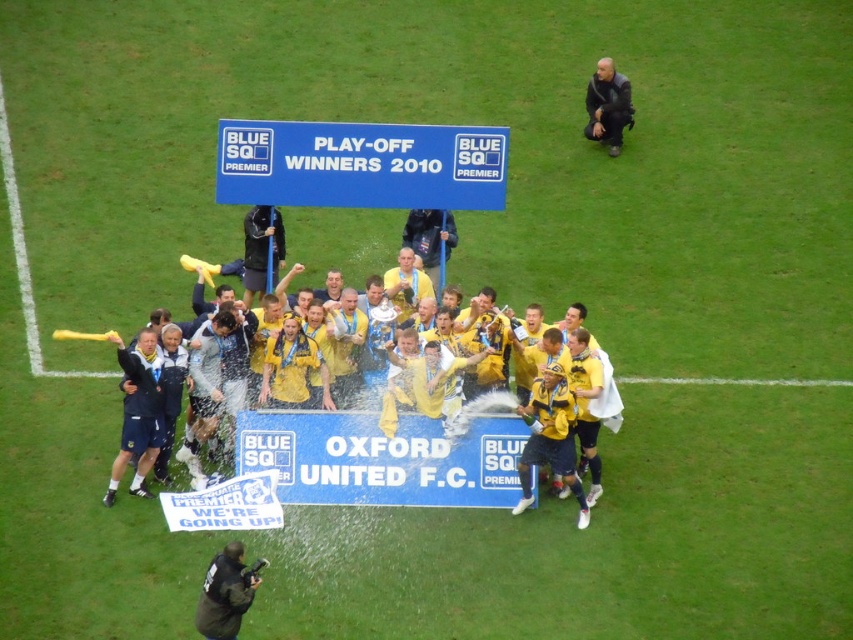
Question: Which is nearer to the dark green jacket at lower center?

Choices:
 (A) yellow jersey at center
 (B) black fabric referee at upper right

Answer: (A)

Question: Which is farther from the yellow jersey at center?

Choices:
 (A) dark green jacket at lower center
 (B) black fabric referee at upper right

Answer: (B)

Question: Does dark green jacket at lower center come behind black fabric referee at upper right?

Choices:
 (A) no
 (B) yes

Answer: (A)

Question: Can you confirm if yellow jersey at center is bigger than dark green jacket at lower center?

Choices:
 (A) yes
 (B) no

Answer: (A)

Question: Which of the following is the closest to the observer?

Choices:
 (A) black fabric referee at upper right
 (B) yellow jersey at center
 (C) dark green jacket at lower center

Answer: (C)

Question: Does yellow jersey at center appear under black fabric referee at upper right?

Choices:
 (A) yes
 (B) no

Answer: (A)